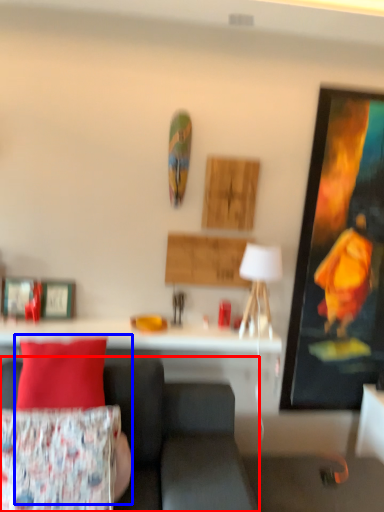
Question: Which point is closer to the camera, studio couch (highlighted by a red box) or person (highlighted by a blue box)?

Choices:
 (A) studio couch
 (B) person

Answer: (A)